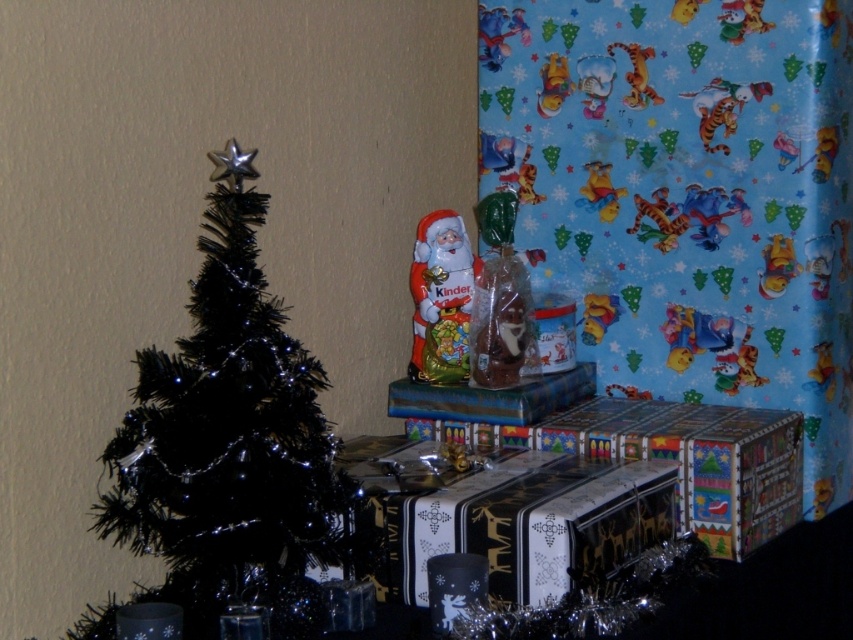
You are a delivery person standing in front of the festive Christmas scene. You need to place a new gift that is 1 meter long on the floor. Is there enough space between you and the black matte gift at center to place it without moving any other items?

The distance between the black matte gift at center and the viewer is 1.28 meters. Since the gift to be placed is 1 meter long, there is sufficient space to place it without moving other items as 1.28 meters is greater than 1 meter.

You are organizing gifts for a Christmas event and need to place the black matte gift at center and the metallic silver gift at center into a display box that can only hold items up to the size of the larger gift. Which gift should you prioritize placing first?

The metallic silver gift at center is larger, so you should prioritize placing it first to ensure it fits in the display box before adding the smaller black matte gift at center.

You are organizing a Christmas gift display and need to stack the black matte gift at center and the matte plastic santa at center vertically. Which one should you place at the bottom to ensure stability?

The black matte gift at center has a lesser height compared to the matte plastic santa at center, so placing the taller matte plastic santa at center at the bottom would provide better stability.